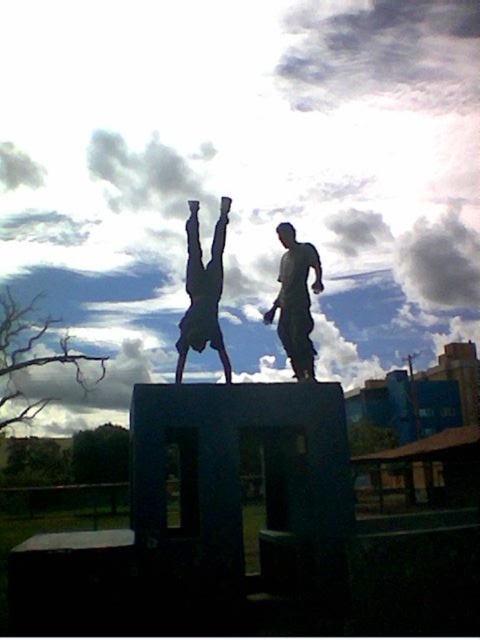
You are a photographer standing 10 meters away from the metallic silver statue at center. You want to take a photo that captures both the statue and a nearby tree located to the left of the statue. The tree is 8 meters away from the statue. Will the tree be in the frame if your camera has a 50mm lens?

The tree is 8 meters away from the metallic silver statue at center, which is within the 10 meters distance you are standing from the statue. Since the camera lens has a 50mm focal length, it can capture objects within this range, so the tree will be in the frame.